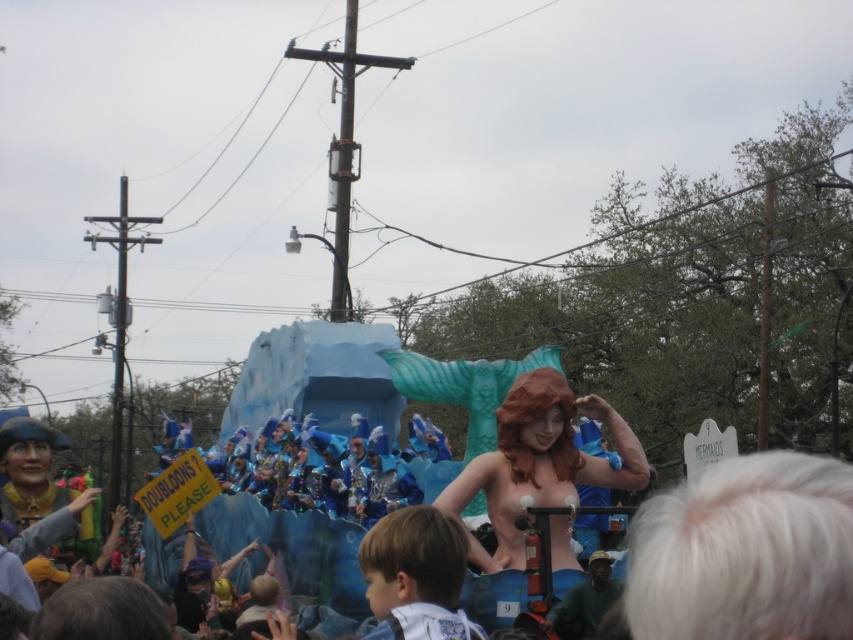
Question: Which point is farther to the camera?

Choices:
 (A) light brown hair at lower center
 (B) smooth blue tail at center

Answer: (B)

Question: Is smooth blue tail at center bigger than light brown hair at lower center?

Choices:
 (A) no
 (B) yes

Answer: (B)

Question: Where is smooth blue tail at center located in relation to light brown hair at lower center in the image?

Choices:
 (A) above
 (B) below

Answer: (A)

Question: Which of the following is the closest to the observer?

Choices:
 (A) light brown hair at lower center
 (B) smooth blue tail at center

Answer: (A)

Question: Which point is closer to the camera?

Choices:
 (A) light brown hair at lower center
 (B) smooth blue tail at center

Answer: (A)

Question: Does smooth blue tail at center appear on the right side of light brown hair at lower center?

Choices:
 (A) yes
 (B) no

Answer: (A)